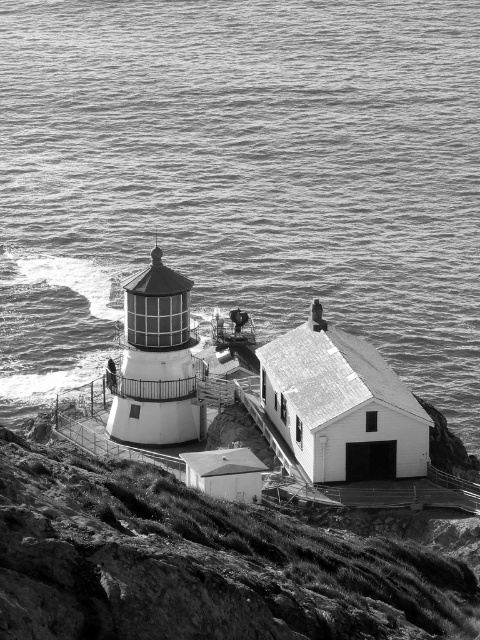
You are a photographer planning to take a picture of the lighthouse. You want to ensure the water at upper center is exactly at the center of the frame. Given that your camera has a grid overlay with coordinates from 0 to 1 on both axes, what adjustment should you make to the camera position?

The water at upper center is currently at coordinate point 0.278 on the x axis and 0.504 on the y axis. To center it, move the camera so the water is at position 0.5 on both axes. This means shifting the camera to the right by 0.222 units on the x axis and slightly down by 0.004 units on the y axis.

Based on the scene, if you were standing on the rugged stone cliff at lower left, which direction would you need to look to see the water at upper center?

The water at upper center is located above the rugged stone cliff at lower left, so you would need to look upward to see it.